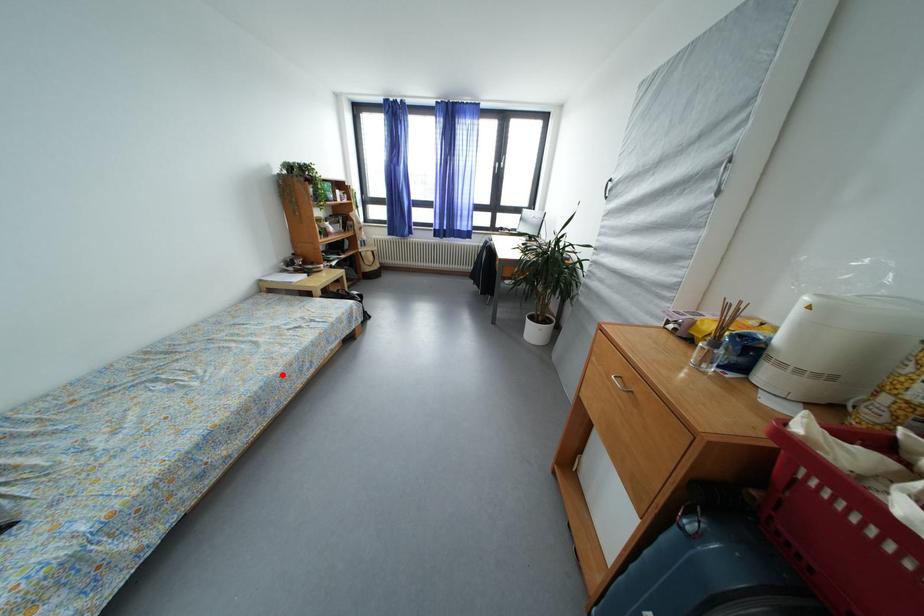
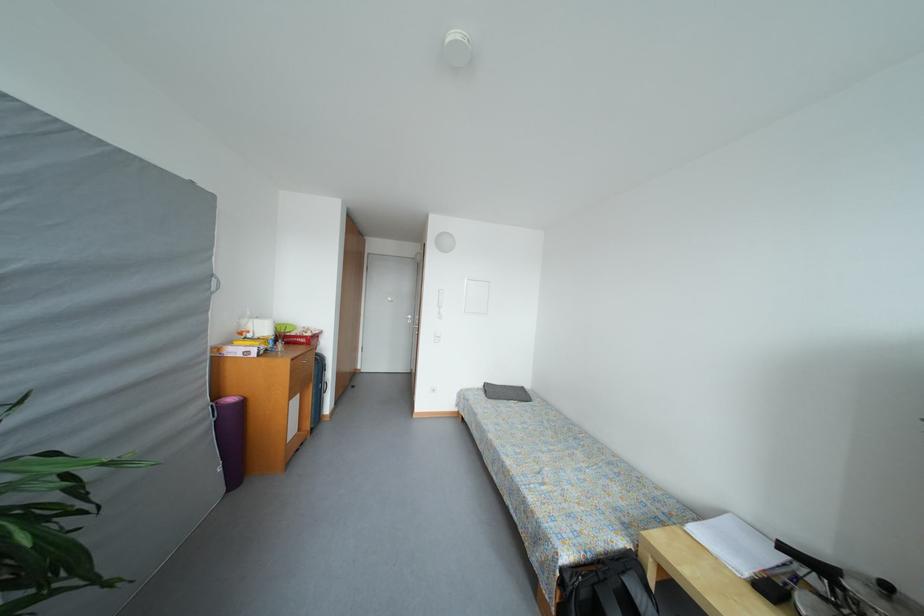
Locate, in the second image, the point that corresponds to the highlighted location in the first image.

(496, 440)